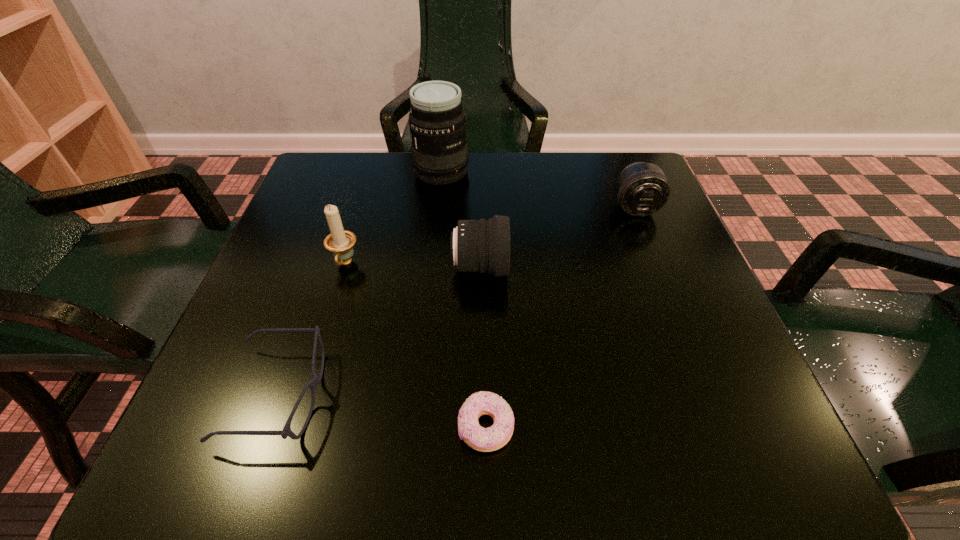
You are a GUI agent. You are given a task and a screenshot of the screen. Output one action in this format:
    pyautogui.click(x=<x>, y=<y>)
    Task: Click on the object at the far right corner
    
    Given the screenshot: What is the action you would take?
    pyautogui.click(x=642, y=189)

You are a GUI agent. You are given a task and a screenshot of the screen. Output one action in this format:
    pyautogui.click(x=<x>, y=<y>)
    Task: Click on the vacant area at the far edge of the desktop
    
    Given the screenshot: What is the action you would take?
    pyautogui.click(x=509, y=156)

In order to click on free location at the near edge in this screenshot , I will do `click(572, 458)`.

At what (x,y) coordinates should I click in order to perform the action: click on free space at the left edge. Please return your answer as a coordinate pair (x, y). The image size is (960, 540). Looking at the image, I should click on point(300,261).

In the image, there is a desktop. Where is `vacant space at the right edge`? The height and width of the screenshot is (540, 960). vacant space at the right edge is located at coordinates (669, 295).

I want to click on blank space at the far left corner of the desktop, so click(x=341, y=156).

In the image, there is a desktop. Where is `vacant space at the near left corner`? The height and width of the screenshot is (540, 960). vacant space at the near left corner is located at coordinates (196, 418).

Where is `free region at the far right corner`? The height and width of the screenshot is (540, 960). free region at the far right corner is located at coordinates (612, 171).

Where is `blank region between the nearest telephoto lens and the farthest telephoto lens`? The image size is (960, 540). blank region between the nearest telephoto lens and the farthest telephoto lens is located at coordinates (461, 220).

The width and height of the screenshot is (960, 540). I want to click on free space between the farthest object and the fifth shortest object, so click(x=394, y=218).